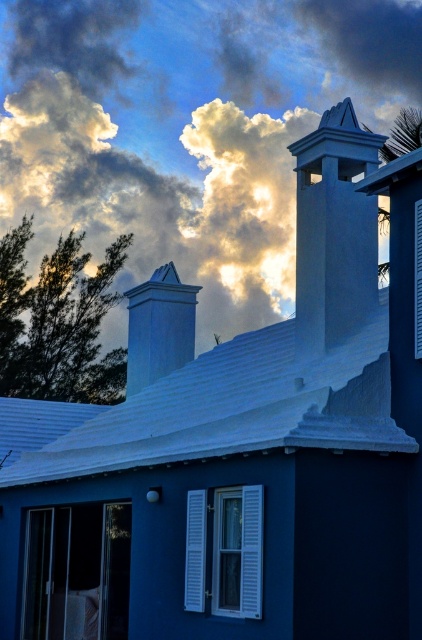
Between smooth white chimney at upper right and white smooth chimney at upper center, which one has less height?

Standing shorter between the two is white smooth chimney at upper center.

Which of these two, smooth white chimney at upper right or white smooth chimney at upper center, stands taller?

With more height is smooth white chimney at upper right.

Is point (327, 323) more distant than point (180, 291)?

No, it is in front of (180, 291).

Find the location of a particular element. The height and width of the screenshot is (640, 422). smooth white chimney at upper right is located at coordinates [x=335, y=230].

How far apart are cloudy sky at upper center and white smooth chimney at upper center?

A distance of 39.95 meters exists between cloudy sky at upper center and white smooth chimney at upper center.

Between cloudy sky at upper center and white smooth chimney at upper center, which one is positioned lower?

Positioned lower is white smooth chimney at upper center.

Does point (48, 90) come closer to viewer compared to point (129, 314)?

That is False.

I want to click on cloudy sky at upper center, so point(189,129).

Does cloudy sky at upper center have a greater width compared to smooth white chimney at upper right?

Indeed, cloudy sky at upper center has a greater width compared to smooth white chimney at upper right.

Does cloudy sky at upper center have a larger size compared to smooth white chimney at upper right?

Indeed, cloudy sky at upper center has a larger size compared to smooth white chimney at upper right.

Which is in front, point (405, 90) or point (375, 246)?

Point (375, 246)

Where is `cloudy sky at upper center`? This screenshot has height=640, width=422. cloudy sky at upper center is located at coordinates (189, 129).